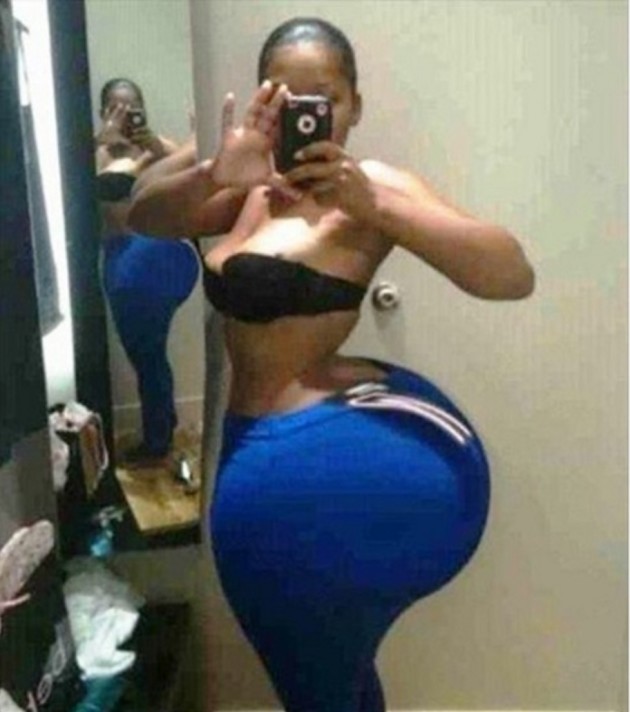
Identify the location of bench. This screenshot has height=712, width=630. (140, 686).